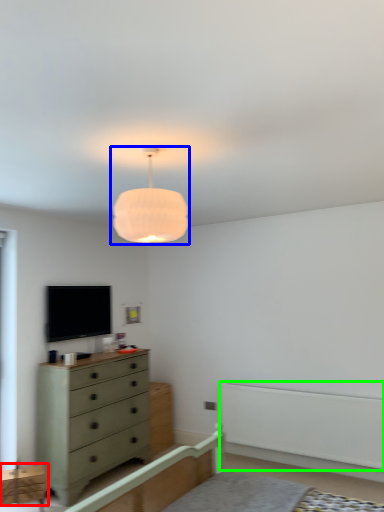
Question: Considering the real-world distances, which object is farthest from cabinetry (highlighted by a red box)? lamp (highlighted by a blue box) or balustrade (highlighted by a green box)?

Choices:
 (A) lamp
 (B) balustrade

Answer: (A)